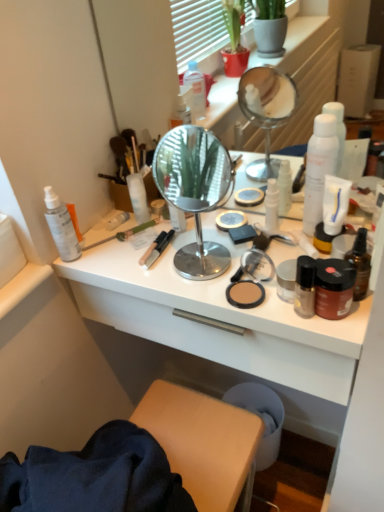
Find the location of `free space in front of white matte spray can at left, the seventh toiletry in the right-to-left sequence`. free space in front of white matte spray can at left, the seventh toiletry in the right-to-left sequence is located at coordinates (97, 271).